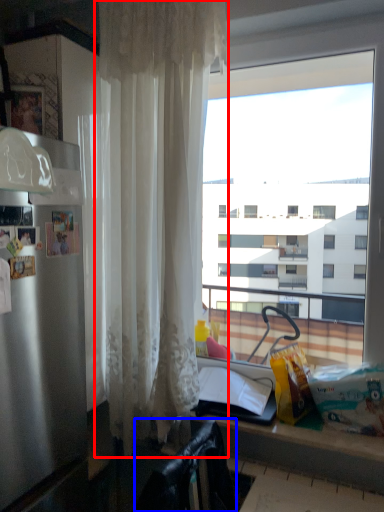
Question: Among these objects, which one is nearest to the camera, curtain (highlighted by a red box) or chair (highlighted by a blue box)?

Choices:
 (A) curtain
 (B) chair

Answer: (B)